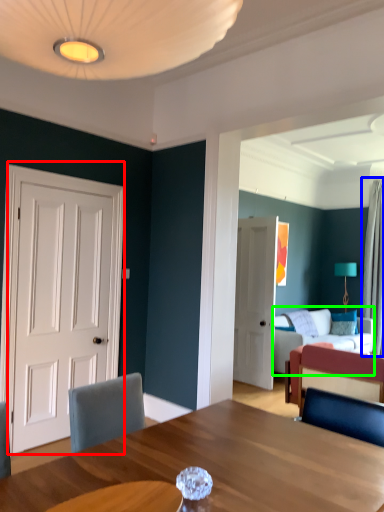
Question: Which object is the farthest from door (highlighted by a red box)? Choose among these: curtain (highlighted by a blue box) or studio couch (highlighted by a green box).

Choices:
 (A) curtain
 (B) studio couch

Answer: (A)